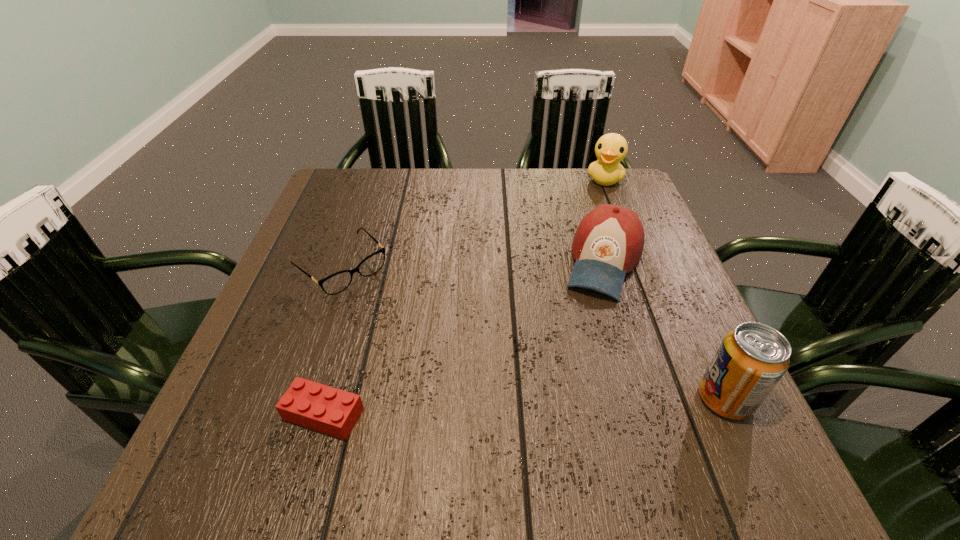
Image resolution: width=960 pixels, height=540 pixels. I want to click on Lego, so (x=322, y=408).

Find the location of `soda can`. soda can is located at coordinates (752, 358).

Where is `baseball cap`? baseball cap is located at coordinates (608, 243).

Find the location of `spectacles`. spectacles is located at coordinates (335, 283).

Locate an element on the screen. This screenshot has width=960, height=540. duck is located at coordinates (611, 149).

You are a GUI agent. You are given a task and a screenshot of the screen. Output one action in this format:
    pyautogui.click(x=<x>, y=<y>)
    Task: Click on the vacant space situated on the right of the Lego
    The height and width of the screenshot is (540, 960).
    Given the screenshot: What is the action you would take?
    pyautogui.click(x=593, y=414)

Find the location of a particular element. This screenshot has width=960, height=540. vacant space located on the left of the soda can is located at coordinates (624, 399).

Find the location of a particular element. The image size is (960, 540). free location located 0.120m on the front-facing side of the baseball cap is located at coordinates (585, 341).

Locate an element on the screen. free point located on the front-facing side of the baseball cap is located at coordinates coord(590,323).

You are a GUI agent. You are given a task and a screenshot of the screen. Output one action in this format:
    pyautogui.click(x=<x>, y=<y>)
    Task: Click on the vacant region located 0.190m on the front-facing side of the baseball cap
    Image resolution: width=960 pixels, height=540 pixels.
    Given the screenshot: What is the action you would take?
    pyautogui.click(x=577, y=369)